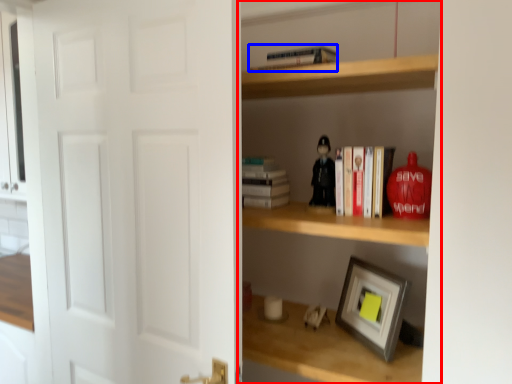
Question: Which of the following is the farthest to the observer, shelf (highlighted by a red box) or book (highlighted by a blue box)?

Choices:
 (A) shelf
 (B) book

Answer: (B)